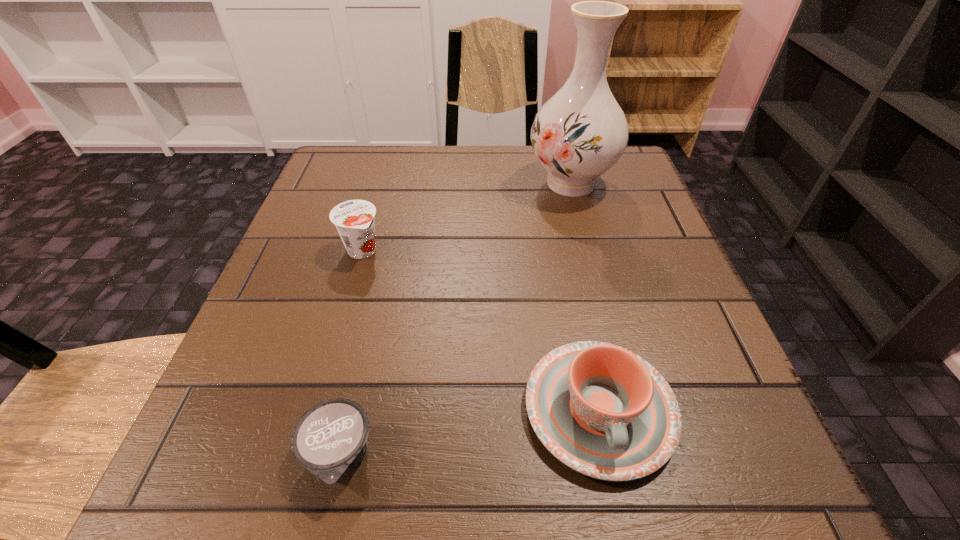
This screenshot has width=960, height=540. I want to click on vacant area at the right edge of the desktop, so click(602, 227).

I want to click on vacant space at the far left corner of the desktop, so click(343, 192).

In order to click on free space at the near right corner of the desktop in this screenshot , I will do `click(701, 481)`.

The height and width of the screenshot is (540, 960). I want to click on vacant area between the nearer yogurt and the chinaware, so point(469,433).

Where is `free space between the nearer yogurt and the chinaware`? free space between the nearer yogurt and the chinaware is located at coordinates (469, 433).

The image size is (960, 540). What are the coordinates of `vacant region between the farther yogurt and the shorter yogurt` in the screenshot? It's located at (350, 354).

Identify the location of free area in between the nearer yogurt and the vase. (455, 320).

In order to click on free space between the shorter yogurt and the farthest object in this screenshot , I will do `click(455, 320)`.

Locate an element on the screen. This screenshot has height=540, width=960. vacant space that is in between the nearer yogurt and the farthest object is located at coordinates (455, 320).

At what (x,y) coordinates should I click in order to perform the action: click on vacant space in between the nearer yogurt and the chinaware. Please return your answer as a coordinate pair (x, y). This screenshot has width=960, height=540. Looking at the image, I should click on (469, 433).